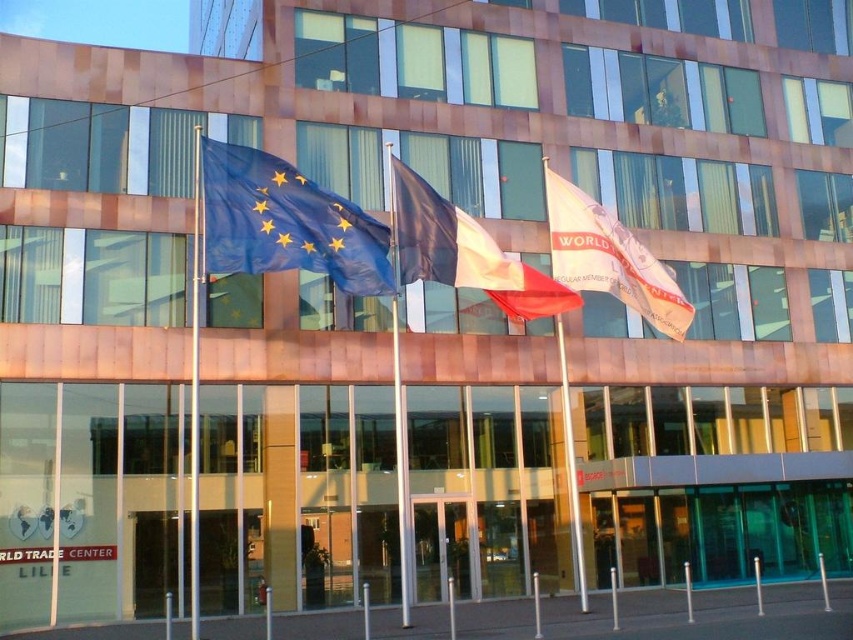
You are standing in front of the building and want to take a photo of the blue fabric flag at center and the metallic flag pole at center. Which one appears closer to you in the photo?

The blue fabric flag at center appears closer to you in the photo because it is further to the viewer than the metallic flag pole at center.

You are standing in front of the building and notice the white fabric flag at center and the silver metallic flag pole at center. Which object is located to the right of the other?

The white fabric flag at center is positioned on the right side of silver metallic flag pole at center.

You are standing in front of the building and notice the white fabric flag at center and the silver metallic flag pole at center. Which object is positioned higher in the scene?

The white fabric flag at center is located above the silver metallic flag pole at center, so it is positioned higher in the scene.